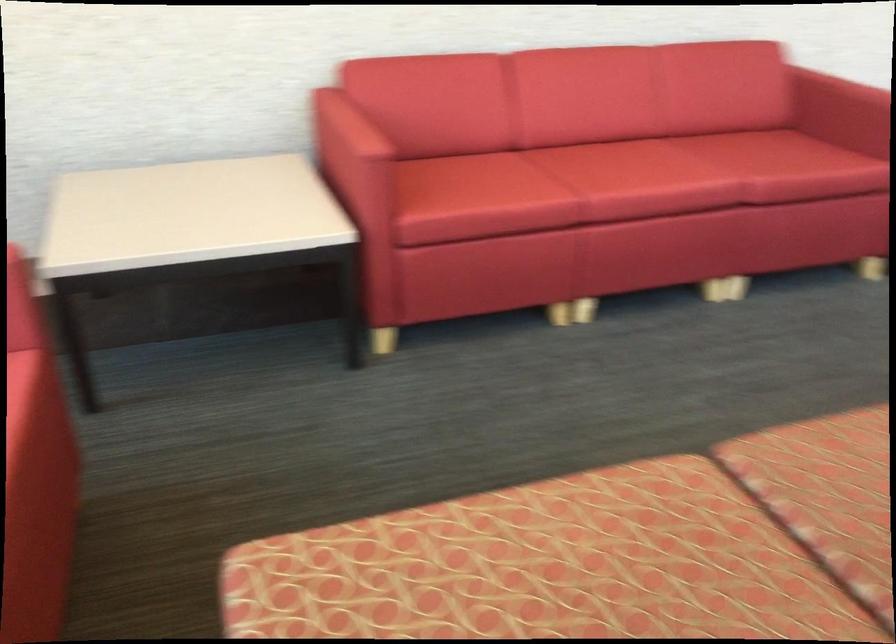
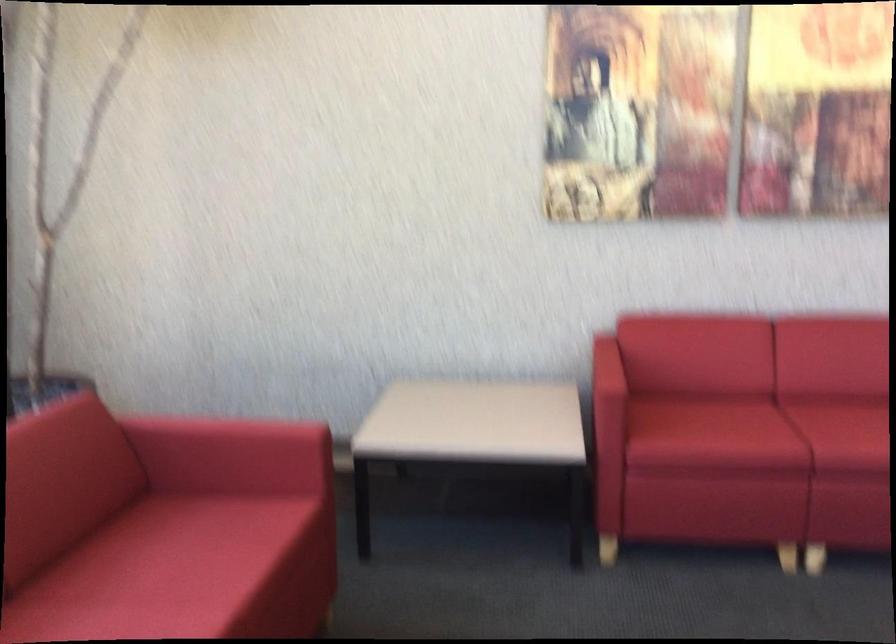
Question: The camera is either moving clockwise (left) or counter-clockwise (right) around the object. The first image is from the beginning of the video and the second image is from the end. Is the camera moving left or right when shooting the video?

Choices:
 (A) Left
 (B) Right

Answer: (B)